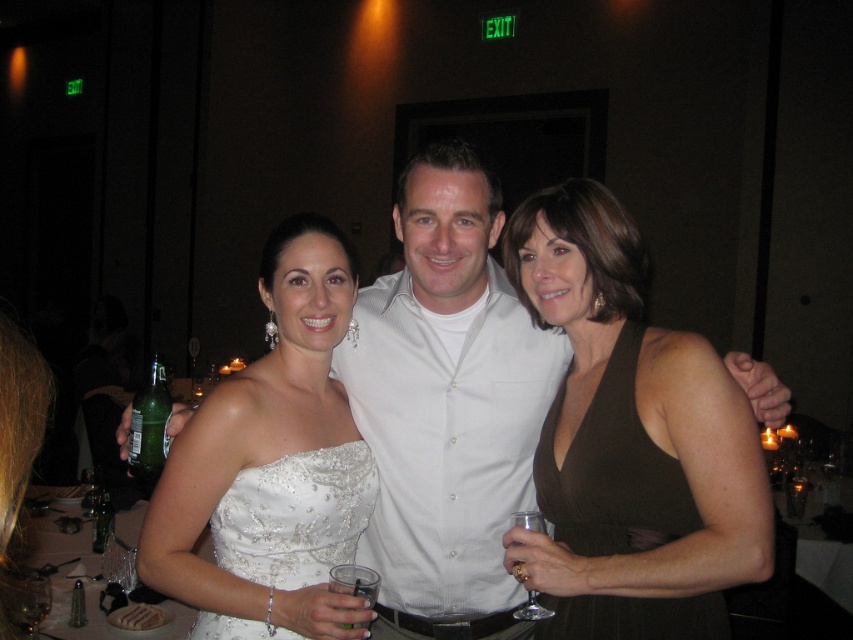
Between satin white dress at center and green glass bottle at lower left, which one has less height?

Standing shorter between the two is green glass bottle at lower left.

This screenshot has width=853, height=640. Find the location of `satin white dress at center`. satin white dress at center is located at coordinates (271, 464).

Locate an element on the screen. satin white dress at center is located at coordinates (271, 464).

Can you confirm if brown satin dress at right is taller than white beaded dress at center?

Yes.

Who is more forward, (563,525) or (316,480)?

Point (316,480)

Which is in front, point (567, 520) or point (223, 506)?

Point (223, 506) is more forward.

I want to click on brown satin dress at right, so click(x=611, y=468).

Is white cotton shirt at center wider than green glass bottle at lower left?

Yes, white cotton shirt at center is wider than green glass bottle at lower left.

Who is more distant from viewer, (x=436, y=460) or (x=146, y=428)?

Positioned behind is point (x=436, y=460).

Find the location of a particular element. The height and width of the screenshot is (640, 853). white cotton shirt at center is located at coordinates (447, 401).